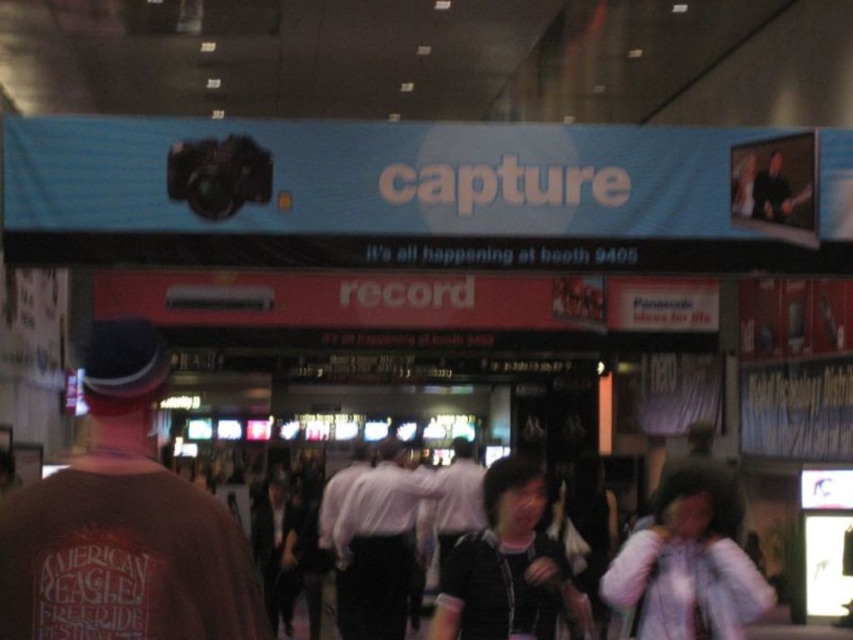
Question: Which object is farther from the camera taking this photo?

Choices:
 (A) black fabric people at center
 (B) white shirt at center

Answer: (B)

Question: Is black fabric people at center above white shirt at center?

Choices:
 (A) yes
 (B) no

Answer: (A)

Question: Which object is the closest to the black fabric people at center?

Choices:
 (A) white shirt at center
 (B) brown cotton t-shirt at left

Answer: (B)

Question: Does black fabric people at center appear on the right side of white shirt at center?

Choices:
 (A) yes
 (B) no

Answer: (A)

Question: Which point is farther from the camera taking this photo?

Choices:
 (A) (676, 582)
 (B) (9, 564)

Answer: (A)

Question: Can you confirm if brown cotton t-shirt at left is wider than black fabric people at center?

Choices:
 (A) yes
 (B) no

Answer: (A)